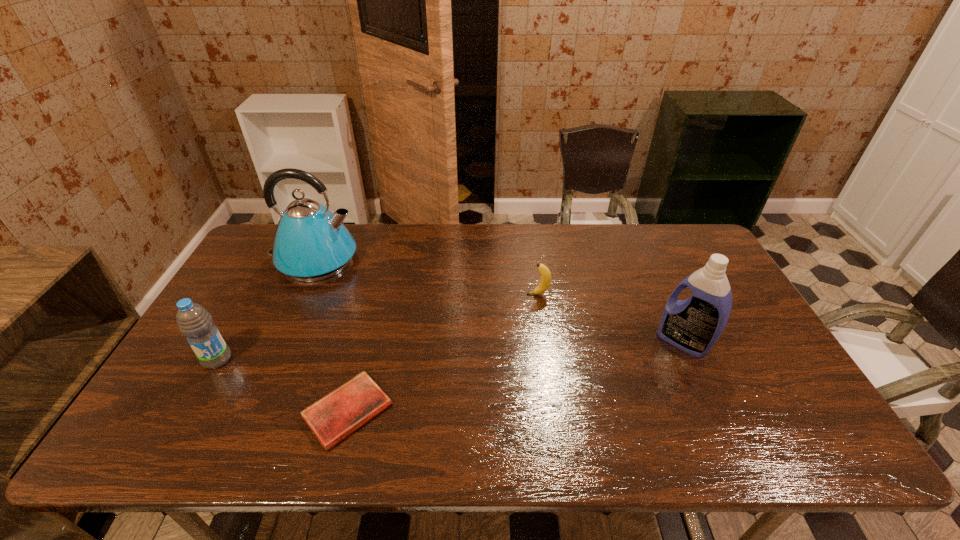
Where is `the farthest object`? The height and width of the screenshot is (540, 960). the farthest object is located at coordinates (311, 243).

Locate an element on the screen. This screenshot has width=960, height=540. detergent is located at coordinates (693, 325).

Where is `the third tallest object`? the third tallest object is located at coordinates (194, 322).

The image size is (960, 540). Find the location of `the second object from right to left`. the second object from right to left is located at coordinates (545, 279).

Identify the location of the second farthest object. The width and height of the screenshot is (960, 540). (545, 279).

Find the location of a particular element. diary is located at coordinates (335, 416).

Locate an element on the screen. The height and width of the screenshot is (540, 960). the shortest object is located at coordinates (335, 416).

I want to click on free space located at the spout of the farthest object, so click(x=433, y=260).

Image resolution: width=960 pixels, height=540 pixels. Identify the location of free space located 0.250m on the left of the detergent. (568, 341).

This screenshot has width=960, height=540. Identify the location of vacant space located on the right of the water bottle. (288, 360).